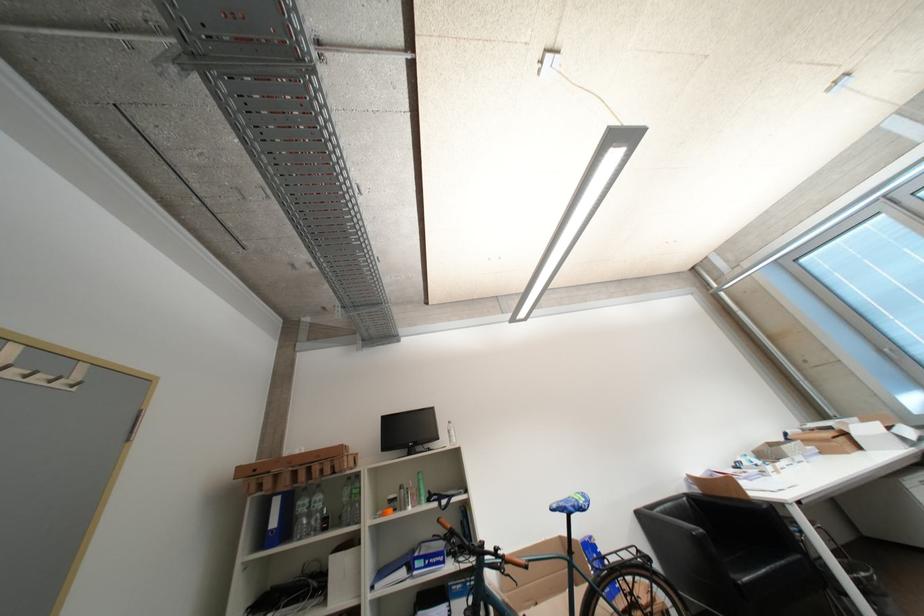
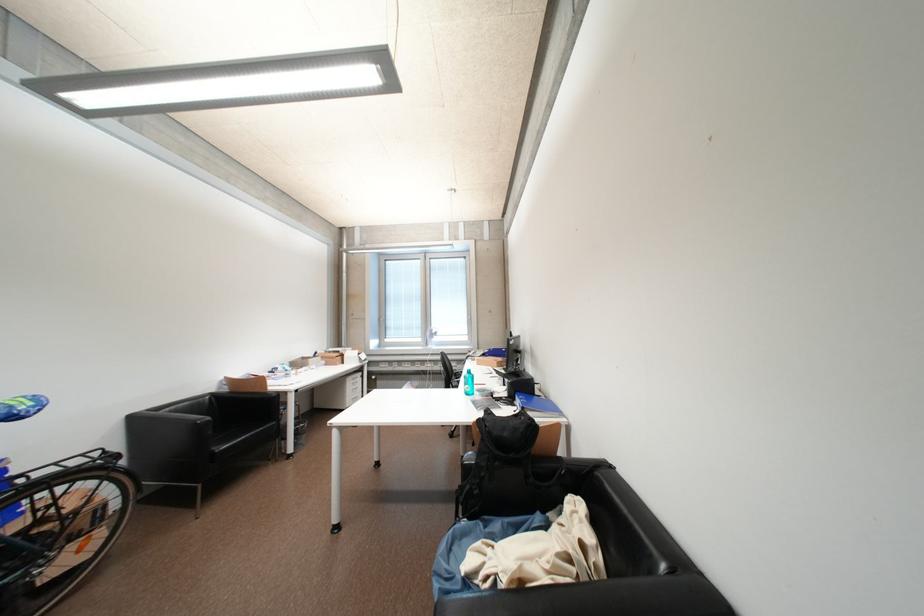
Question: The camera is either moving clockwise (left) or counter-clockwise (right) around the object. The first image is from the beginning of the video and the second image is from the end. Is the camera moving left or right when shooting the video?

Choices:
 (A) Left
 (B) Right

Answer: (A)